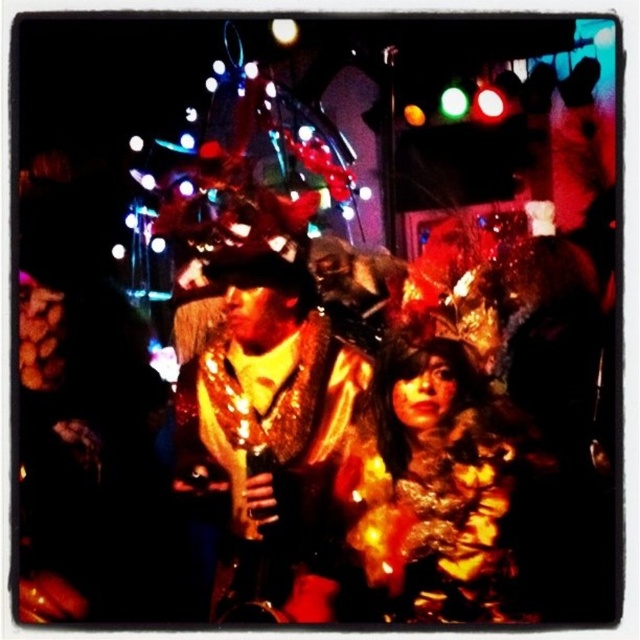
Question: Among these points, which one is nearest to the camera?

Choices:
 (A) (492, 397)
 (B) (266, 568)

Answer: (A)

Question: Which point appears closest to the camera in this image?

Choices:
 (A) pos(440,496)
 (B) pos(276,305)

Answer: (A)

Question: Does shiny gold jacket at center have a lesser width compared to fuzzy fur coat at center?

Choices:
 (A) yes
 (B) no

Answer: (B)

Question: Is shiny gold jacket at center positioned behind fuzzy fur coat at center?

Choices:
 (A) no
 (B) yes

Answer: (B)

Question: Which point appears closest to the camera in this image?

Choices:
 (A) (381, 403)
 (B) (266, 412)

Answer: (A)

Question: Where is shiny gold jacket at center located in relation to fuzzy fur coat at center in the image?

Choices:
 (A) below
 (B) above

Answer: (B)